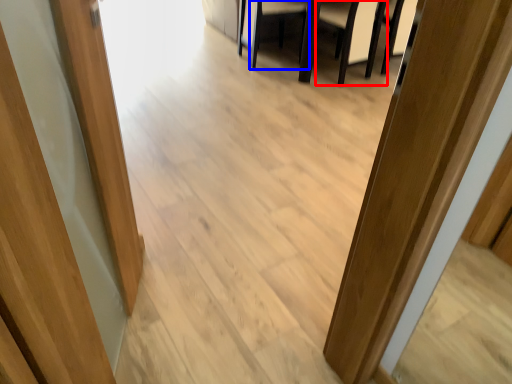
Question: Among these objects, which one is farthest to the camera, armchair (highlighted by a red box) or armchair (highlighted by a blue box)?

Choices:
 (A) armchair
 (B) armchair

Answer: (B)